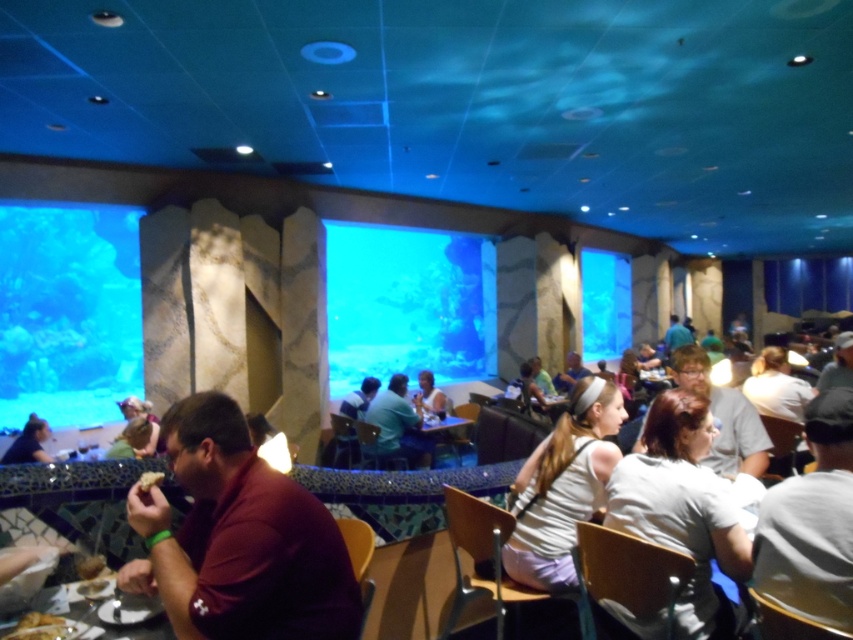
Does white matte shirt at lower right appear on the right side of light brown hair at center?

Correct, you'll find white matte shirt at lower right to the right of light brown hair at center.

Can you confirm if white matte shirt at lower right is wider than light brown hair at center?

Yes, white matte shirt at lower right is wider than light brown hair at center.

You are a GUI agent. You are given a task and a screenshot of the screen. Output one action in this format:
    pyautogui.click(x=<x>, y=<y>)
    Task: Click on the white matte shirt at lower right
    The width and height of the screenshot is (853, 640).
    Given the screenshot: What is the action you would take?
    pyautogui.click(x=682, y=508)

Image resolution: width=853 pixels, height=640 pixels. What are the coordinates of `white matte shirt at lower right` in the screenshot? It's located at (682, 508).

Does point (787, 532) come closer to viewer compared to point (0, 636)?

No.

Between gray cotton shirt at lower right and wooden table at lower left, which one has more height?

gray cotton shirt at lower right is taller.

Between point (846, 620) and point (155, 621), which one is positioned behind?

Point (155, 621)

In order to click on gray cotton shirt at lower right in this screenshot , I will do `click(811, 522)`.

Does white matte shirt at lower right have a lesser width compared to light blue shirt at center?

Correct, white matte shirt at lower right's width is less than light blue shirt at center's.

Does white matte shirt at lower right have a larger size compared to light blue shirt at center?

No, white matte shirt at lower right is not bigger than light blue shirt at center.

Between point (724, 634) and point (378, 428), which one is positioned in front?

Point (724, 634) is more forward.

Identify the location of white matte shirt at lower right. This screenshot has height=640, width=853. (682, 508).